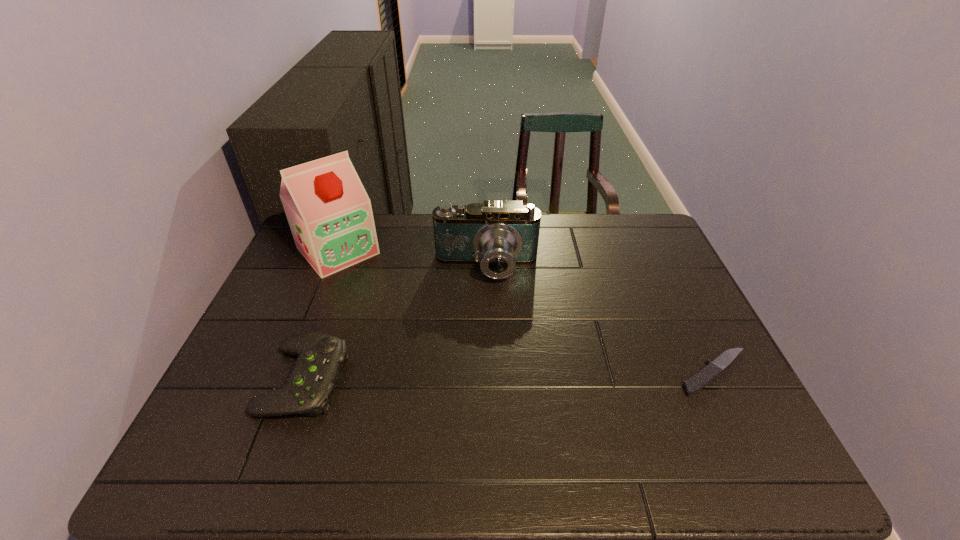
Where is `free location located 0.360m with the cap open on the tallest object`? This screenshot has height=540, width=960. free location located 0.360m with the cap open on the tallest object is located at coordinates (423, 343).

Where is `vacant space situated on the front-facing side of the camcorder`? vacant space situated on the front-facing side of the camcorder is located at coordinates (483, 396).

The image size is (960, 540). I want to click on vacant region located on the front-facing side of the camcorder, so click(x=484, y=351).

Image resolution: width=960 pixels, height=540 pixels. What are the coordinates of `vacant region located 0.090m on the front-facing side of the camcorder` in the screenshot? It's located at (485, 311).

The image size is (960, 540). In order to click on soya milk that is at the far edge in this screenshot , I will do `click(330, 216)`.

Where is `camcorder located at the far edge`? The height and width of the screenshot is (540, 960). camcorder located at the far edge is located at coordinates (499, 235).

Identify the location of control positioned at the near edge. (316, 371).

Where is `steak knife located in the near edge section of the desktop`? steak knife located in the near edge section of the desktop is located at coordinates (701, 379).

Where is `control that is at the left edge`? The width and height of the screenshot is (960, 540). control that is at the left edge is located at coordinates (316, 371).

The image size is (960, 540). I want to click on soya milk present at the left edge, so click(x=330, y=216).